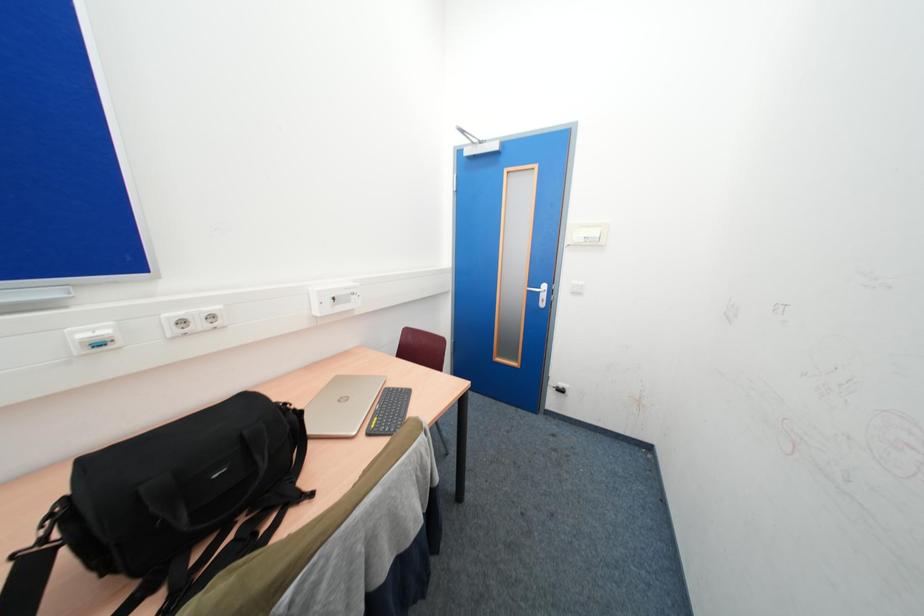
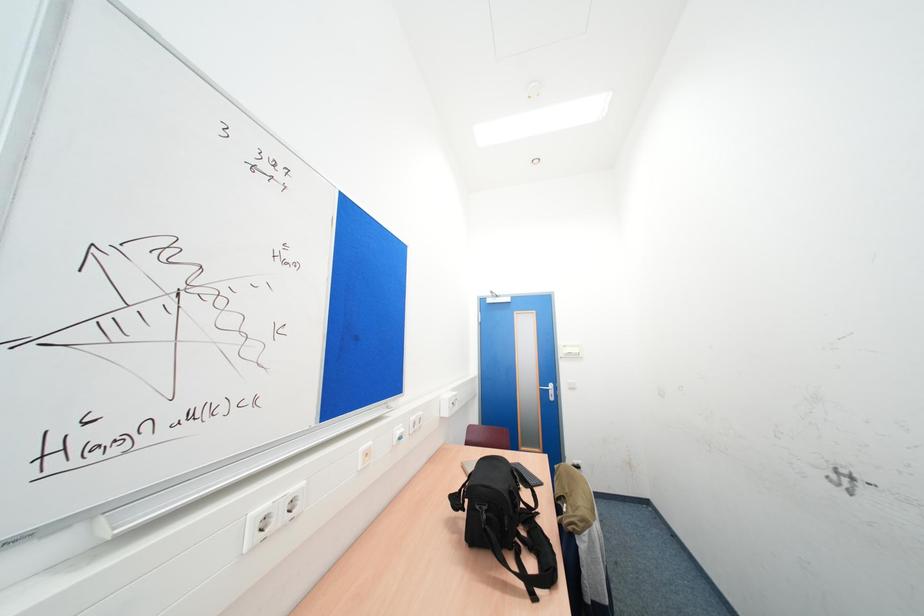
The images are taken continuously from a first-person perspective. In which direction are you moving?

The cameraman moved toward left, backward.